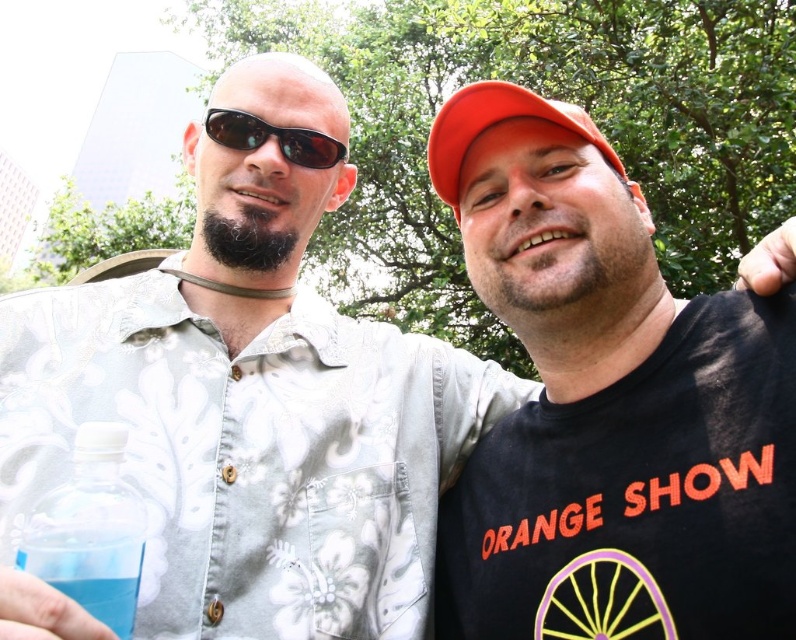
Question: Is translucent plastic bottle at lower left closer to the viewer compared to black reflective sunglasses at upper left?

Choices:
 (A) yes
 (B) no

Answer: (A)

Question: Which of the following is the closest to the observer?

Choices:
 (A) translucent plastic bottle at lower left
 (B) white floral button-up shirt at center

Answer: (A)

Question: Which of these objects is positioned closest to the orange matte baseball hat at upper right?

Choices:
 (A) matte black t-shirt at center
 (B) transparent plastic bottle at lower left
 (C) black reflective sunglasses at upper left
 (D) white floral button-up shirt at center

Answer: (C)

Question: Which point is farther from the camera taking this photo?

Choices:
 (A) (461, 161)
 (B) (287, 413)
 (C) (244, 115)

Answer: (C)

Question: Can you confirm if matte black t-shirt at center is positioned to the right of translucent plastic bottle at lower left?

Choices:
 (A) no
 (B) yes

Answer: (B)

Question: From the image, what is the correct spatial relationship of transparent plastic bottle at lower left in relation to black reflective sunglasses at upper left?

Choices:
 (A) below
 (B) above

Answer: (A)